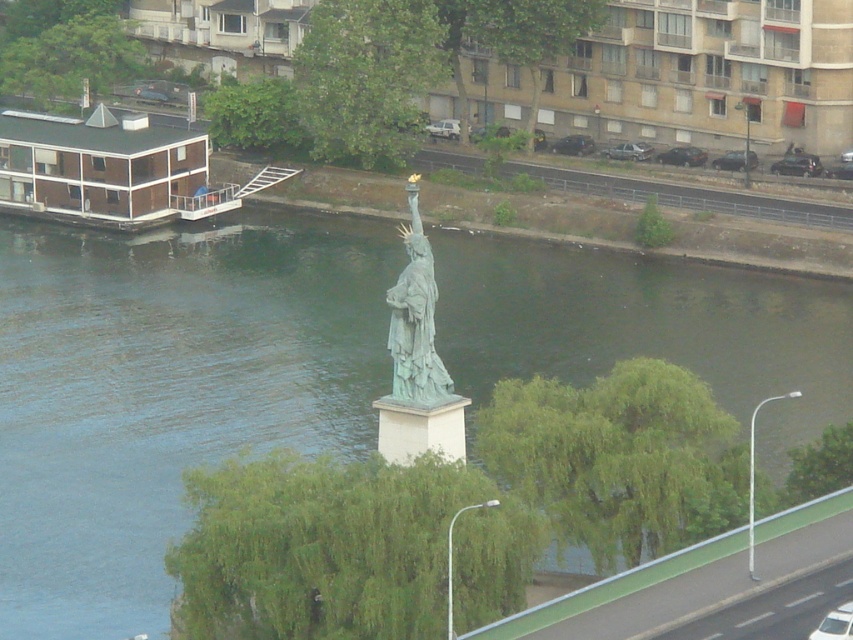
You are a GUI agent. You are given a task and a screenshot of the screen. Output one action in this format:
    pyautogui.click(x=<x>, y=<y>)
    Task: Click on the greenish water at center
    The image size is (853, 640).
    Given the screenshot: What is the action you would take?
    pyautogui.click(x=166, y=390)